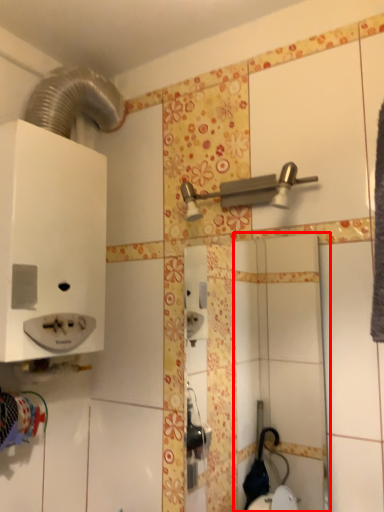
Question: In this image, where is mirror (annotated by the red box) located relative to shower?

Choices:
 (A) left
 (B) right

Answer: (B)